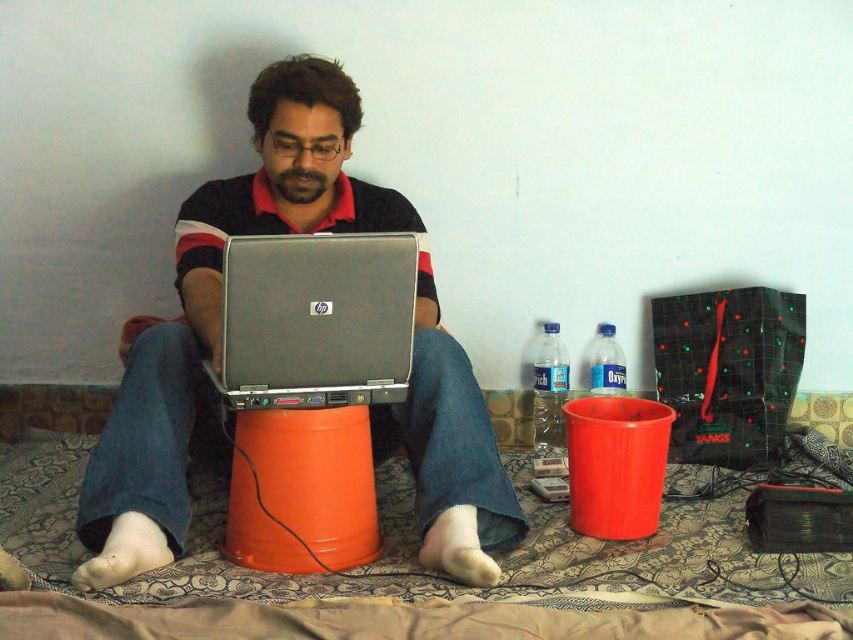
You are trying to reach for the transparent plastic bottle at right while holding the matte black laptop at center. Which object will you need to move first?

You need to move the matte black laptop at center first because it is closer to you than the transparent plastic bottle at right, so you must adjust it before accessing the bottle.

You are trying to determine if the silver metallic laptop at center can fit into a storage compartment that can only accommodate items narrower than the clear plastic bottle at center right. Based on their widths, will the laptop fit?

The silver metallic laptop at center is wider than the clear plastic bottle at center right, so it will not fit into the storage compartment designed for items narrower than the bottle.